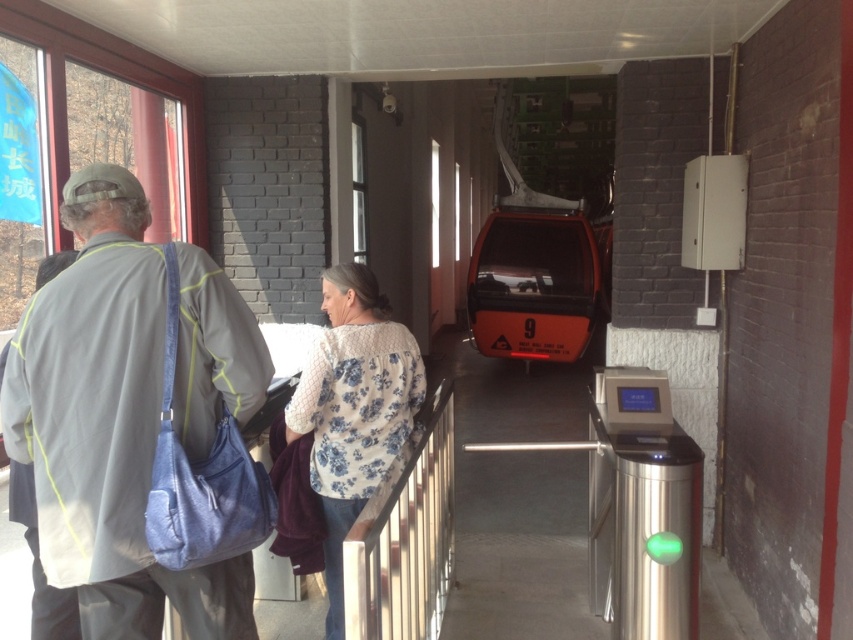
Which is more to the right, floral-patterned sweater at center or orange matte cable car at center?

orange matte cable car at center

The width and height of the screenshot is (853, 640). I want to click on floral-patterned sweater at center, so click(x=352, y=408).

Which is above, light gray fabric jacket at left or orange matte cable car at center?

Positioned higher is orange matte cable car at center.

Is light gray fabric jacket at left bigger than orange matte cable car at center?

No, light gray fabric jacket at left is not bigger than orange matte cable car at center.

Is point (42, 317) positioned after point (569, 326)?

No, it is not.

In order to click on light gray fabric jacket at left in this screenshot , I will do `click(107, 426)`.

Which of these two, light gray fabric jacket at left or floral-patterned sweater at center, stands taller?

floral-patterned sweater at center

In the scene shown: Can you confirm if light gray fabric jacket at left is bigger than floral-patterned sweater at center?

Actually, light gray fabric jacket at left might be smaller than floral-patterned sweater at center.

Which is behind, point (86, 476) or point (410, 403)?

Point (410, 403)

This screenshot has width=853, height=640. I want to click on light gray fabric jacket at left, so click(x=107, y=426).